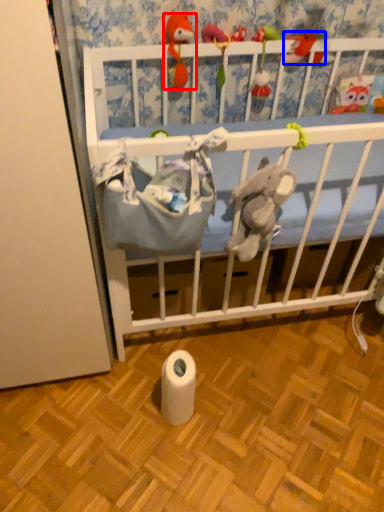
Question: Which object is closer to the camera taking this photo, toy (highlighted by a red box) or toy (highlighted by a blue box)?

Choices:
 (A) toy
 (B) toy

Answer: (A)